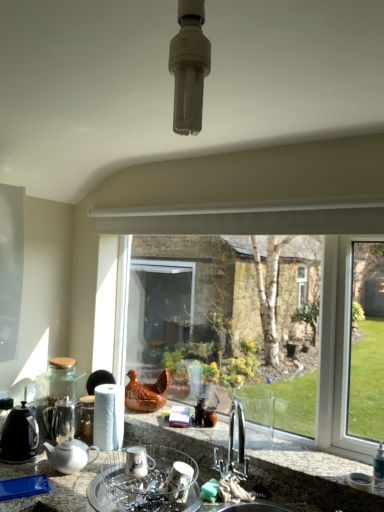
The height and width of the screenshot is (512, 384). Identify the location of vacant space in between porcelain dish rack at center, the 2th appliance viewed from the back, and white ceramic mug at lower center, the first appliance when ordered from back to front. (118, 484).